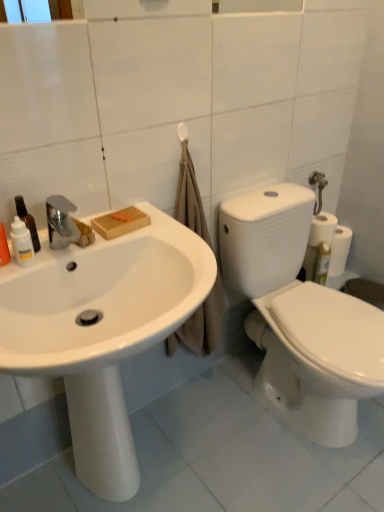
Where is `empty space that is to the right of translucent plastic spray bottle at left, which appears as the second cleaning product when viewed from the right`? This screenshot has width=384, height=512. empty space that is to the right of translucent plastic spray bottle at left, which appears as the second cleaning product when viewed from the right is located at coordinates (56, 256).